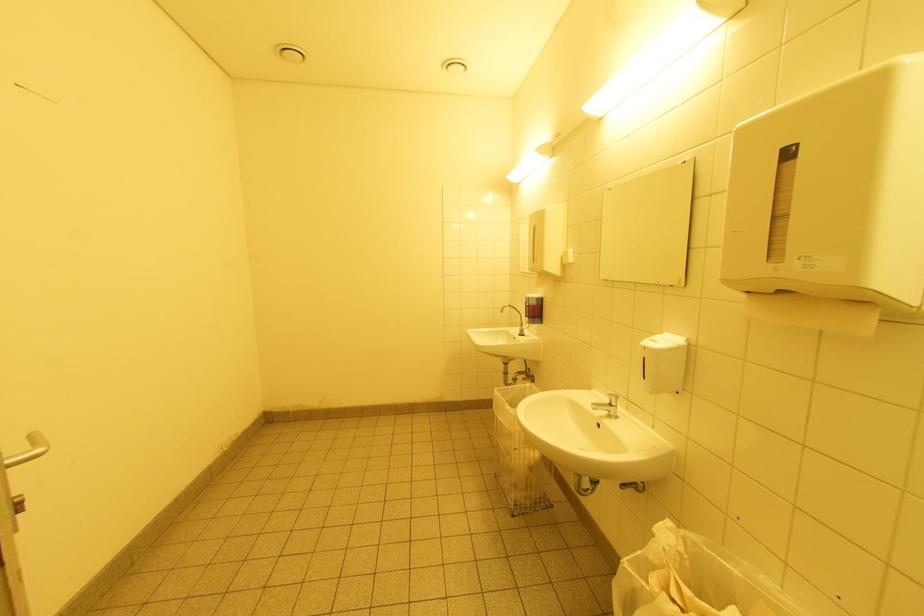
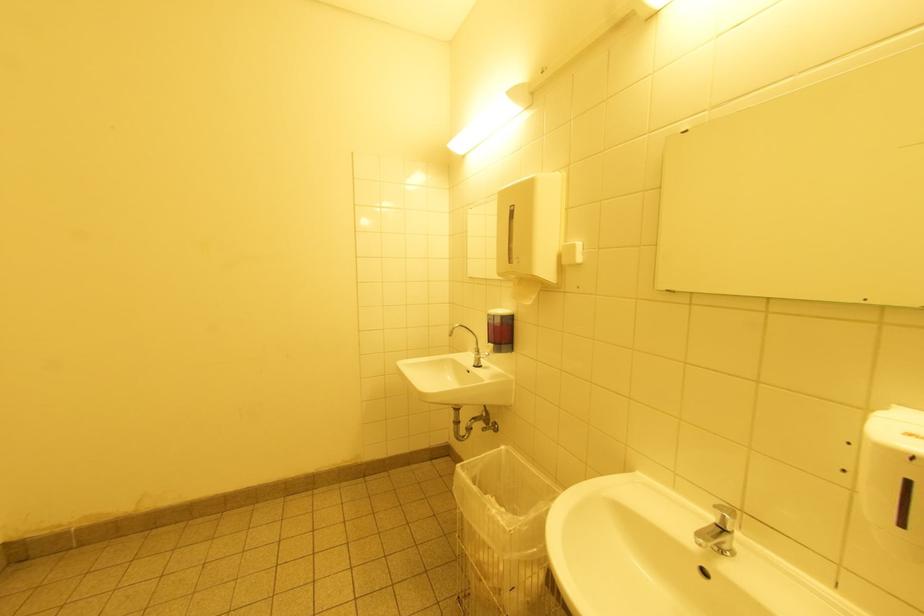
Question: The camera is either moving clockwise (left) or counter-clockwise (right) around the object. The first image is from the beginning of the video and the second image is from the end. Is the camera moving left or right when shooting the video?

Choices:
 (A) Left
 (B) Right

Answer: (A)